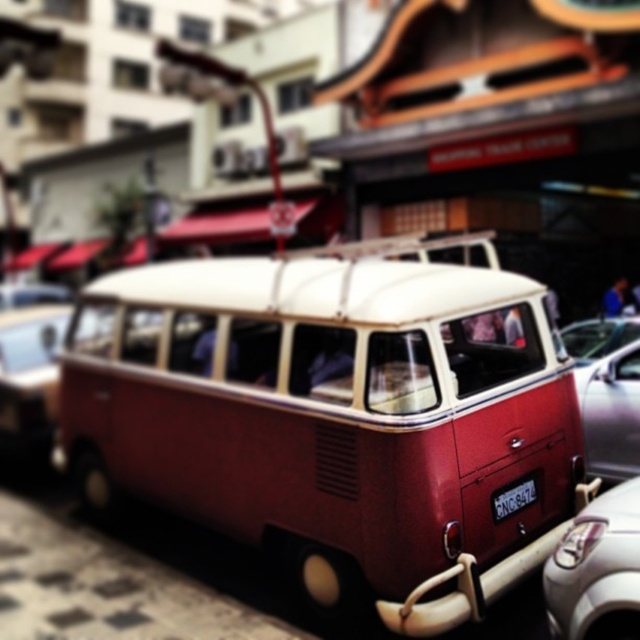
Does point (628, 435) come in front of point (506, 493)?

No, (628, 435) is further to viewer.

Find the location of a particular element. metallic silver car at right is located at coordinates (609, 401).

Is point (496, 276) closer to viewer compared to point (547, 618)?

No, it is behind (547, 618).

Does matte red bus at center have a greater height compared to white glossy car at lower right?

Indeed, matte red bus at center has a greater height compared to white glossy car at lower right.

Which is in front, point (316, 358) or point (625, 627)?

Point (625, 627) is more forward.

Locate an element on the screen. matte red bus at center is located at coordinates (336, 417).

Can you confirm if matte red bus at center is bigger than black plastic license plate at center?

Yes, matte red bus at center is bigger than black plastic license plate at center.

Is point (433, 305) behind point (518, 508)?

That is False.

Image resolution: width=640 pixels, height=640 pixels. In order to click on matte red bus at center in this screenshot , I will do `click(336, 417)`.

This screenshot has width=640, height=640. Identify the location of matte red bus at center. (336, 417).